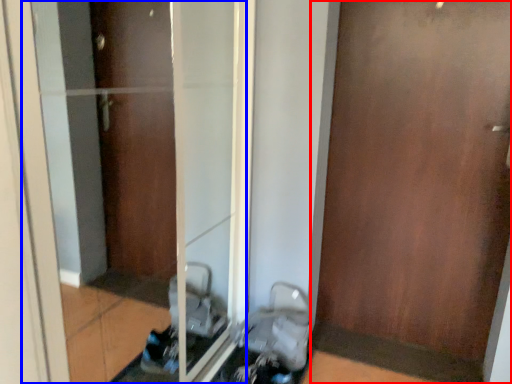
Question: Which object is further to the camera taking this photo, door (highlighted by a red box) or glass door (highlighted by a blue box)?

Choices:
 (A) door
 (B) glass door

Answer: (A)